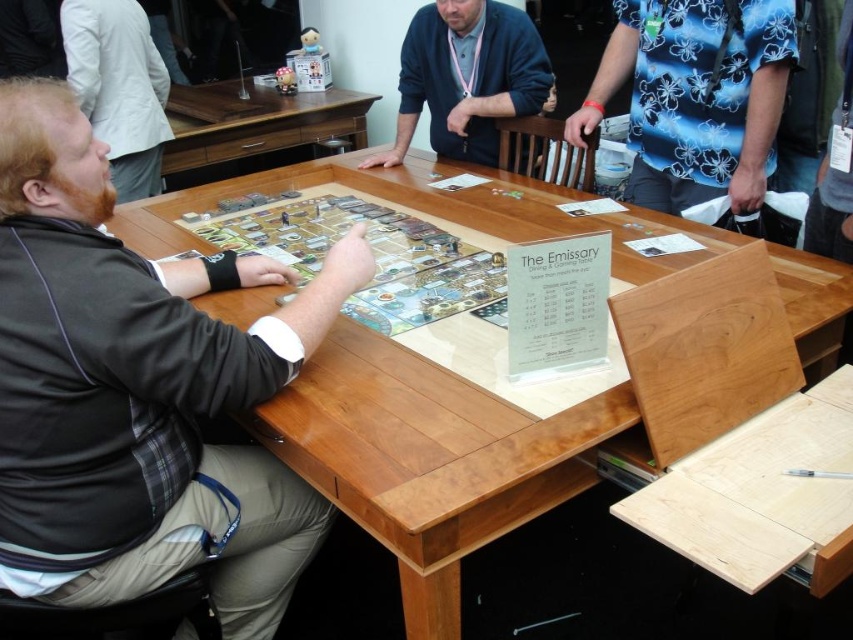
Question: Which of these objects is positioned farthest from the blue floral shirt at upper right?

Choices:
 (A) wooden board game at center
 (B) dark blue sweater at center

Answer: (A)

Question: Is wooden table at center above blue floral shirt at upper right?

Choices:
 (A) yes
 (B) no

Answer: (B)

Question: Which of these objects is positioned farthest from the wooden table at center?

Choices:
 (A) dark brown leather jacket at left
 (B) dark blue sweater at center
 (C) wooden board game at center
 (D) dark gray jacket at left

Answer: (A)

Question: Is wooden board game at center wider than dark blue sweater at center?

Choices:
 (A) yes
 (B) no

Answer: (A)

Question: Is wooden table at center smaller than brown wood table at upper center?

Choices:
 (A) no
 (B) yes

Answer: (A)

Question: Which point is farther to the camera?

Choices:
 (A) (463, 147)
 (B) (167, 435)
 (C) (221, 97)

Answer: (C)